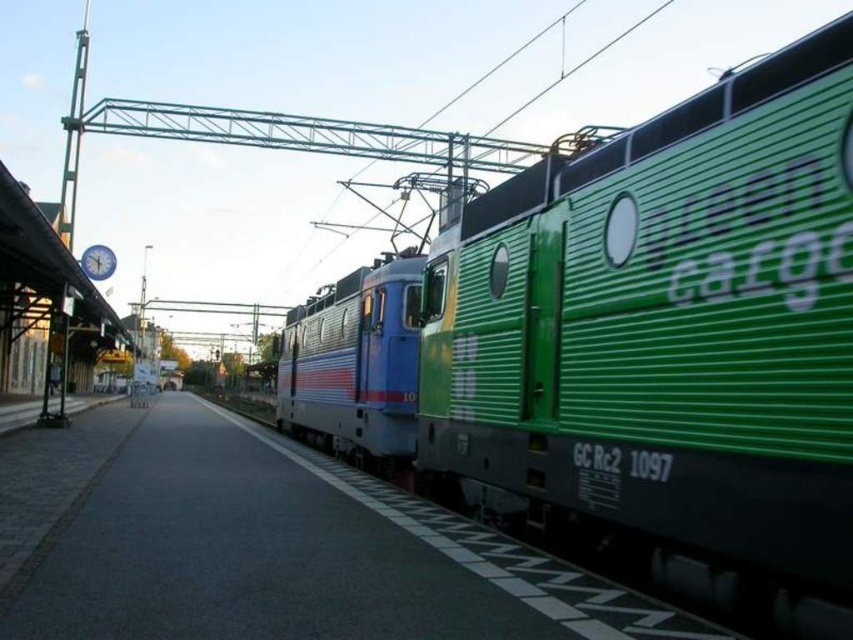
Question: Is green corrugated train at right closer to camera compared to metallic blue train car at center?

Choices:
 (A) yes
 (B) no

Answer: (A)

Question: Is green corrugated train at right in front of metallic blue train car at center?

Choices:
 (A) yes
 (B) no

Answer: (A)

Question: Which point appears closest to the camera in this image?

Choices:
 (A) (379, 419)
 (B) (502, 474)

Answer: (B)

Question: Among these objects, which one is nearest to the camera?

Choices:
 (A) metallic blue train car at center
 (B) green corrugated train at right

Answer: (B)

Question: Where is green corrugated train at right located in relation to metallic blue train car at center in the image?

Choices:
 (A) below
 (B) above

Answer: (B)